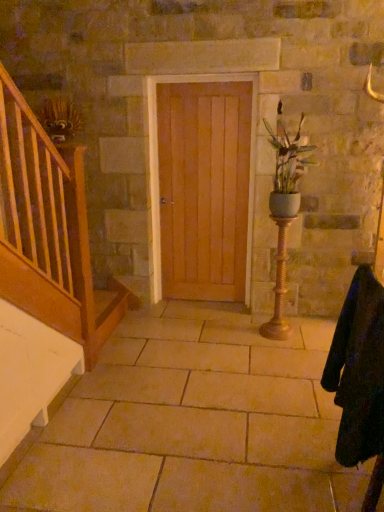
The image size is (384, 512). Identify the location of free space in front of light brown wood door at center. (204, 322).